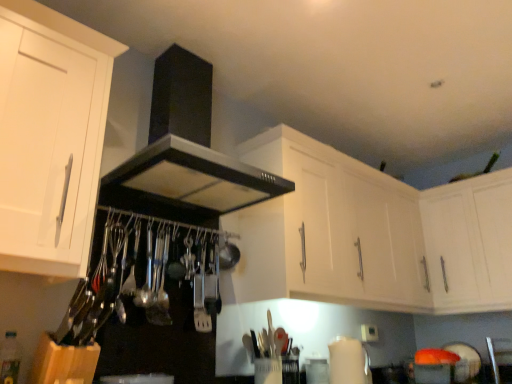
Question: Is white matte cabinet at upper center, placed as the second cabinetry when sorted from right to left, far from white matte cabinet at upper right, which appears as the 3th cabinetry when viewed from the left?

Choices:
 (A) no
 (B) yes

Answer: (A)

Question: Does white matte cabinet at upper center, placed as the second cabinetry when sorted from right to left, lie behind white matte cabinet at upper right, which appears as the 3th cabinetry when viewed from the left?

Choices:
 (A) no
 (B) yes

Answer: (A)

Question: Is white matte cabinet at upper center, placed as the second cabinetry when sorted from right to left, next to white matte cabinet at upper right, which appears as the 3th cabinetry when viewed from the left?

Choices:
 (A) no
 (B) yes

Answer: (A)

Question: Would you say white matte cabinet at upper right, the first cabinetry from the right, is part of white matte cabinet at upper center, placed as the second cabinetry when sorted from right to left,'s contents?

Choices:
 (A) yes
 (B) no

Answer: (B)

Question: Considering the relative sizes of white matte cabinet at upper center, marked as the 2th cabinetry in a left-to-right arrangement, and white matte cabinet at upper right, which appears as the 3th cabinetry when viewed from the left, in the image provided, is white matte cabinet at upper center, marked as the 2th cabinetry in a left-to-right arrangement, bigger than white matte cabinet at upper right, which appears as the 3th cabinetry when viewed from the left,?

Choices:
 (A) yes
 (B) no

Answer: (A)

Question: From the image's perspective, would you say white matte cabinet at upper center, placed as the second cabinetry when sorted from right to left, is positioned over white matte cabinet at upper right, the first cabinetry from the right?

Choices:
 (A) no
 (B) yes

Answer: (B)

Question: Can you confirm if satin nickel spatula at center is taller than white matte cabinet at left, the 3th cabinetry from the right?

Choices:
 (A) yes
 (B) no

Answer: (B)

Question: Is satin nickel spatula at center smaller than white matte cabinet at left, the 3th cabinetry from the right?

Choices:
 (A) yes
 (B) no

Answer: (A)

Question: Is the position of satin nickel spatula at center less distant than that of white matte cabinet at left, which ranks as the first cabinetry in left-to-right order?

Choices:
 (A) yes
 (B) no

Answer: (B)

Question: From the image's perspective, is satin nickel spatula at center under white matte cabinet at left, the 3th cabinetry from the right?

Choices:
 (A) no
 (B) yes

Answer: (B)

Question: Can you confirm if satin nickel spatula at center is shorter than white matte cabinet at left, the 3th cabinetry from the right?

Choices:
 (A) no
 (B) yes

Answer: (B)

Question: Is white matte cabinet at left, which ranks as the first cabinetry in left-to-right order, surrounded by satin nickel spatula at center?

Choices:
 (A) yes
 (B) no

Answer: (B)

Question: Are white matte cabinet at upper right, the first cabinetry from the right, and satin nickel spatula at center far apart?

Choices:
 (A) no
 (B) yes

Answer: (B)